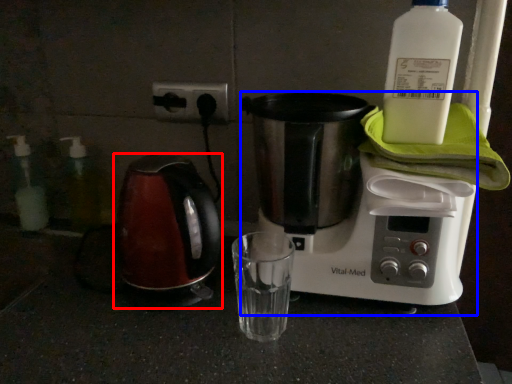
Question: Which object appears farthest to the camera in this image, kettle (highlighted by a red box) or coffee maker (highlighted by a blue box)?

Choices:
 (A) kettle
 (B) coffee maker

Answer: (A)